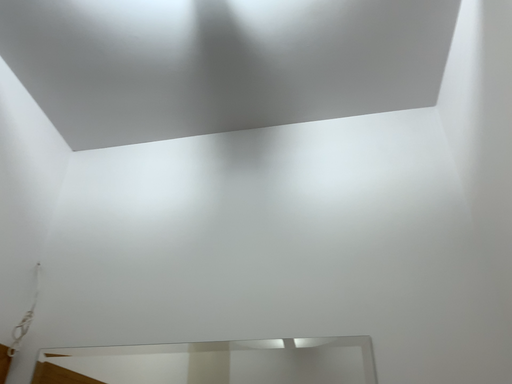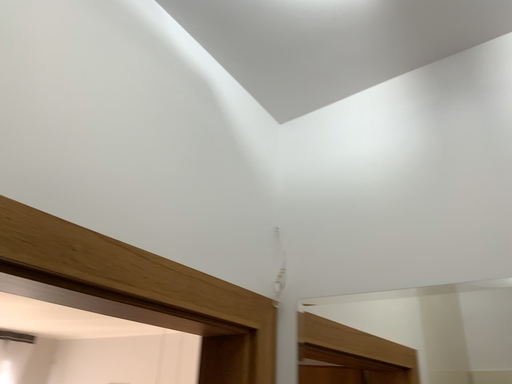
Question: Which way did the camera rotate in the video?

Choices:
 (A) rotated downward
 (B) rotated upward

Answer: (A)